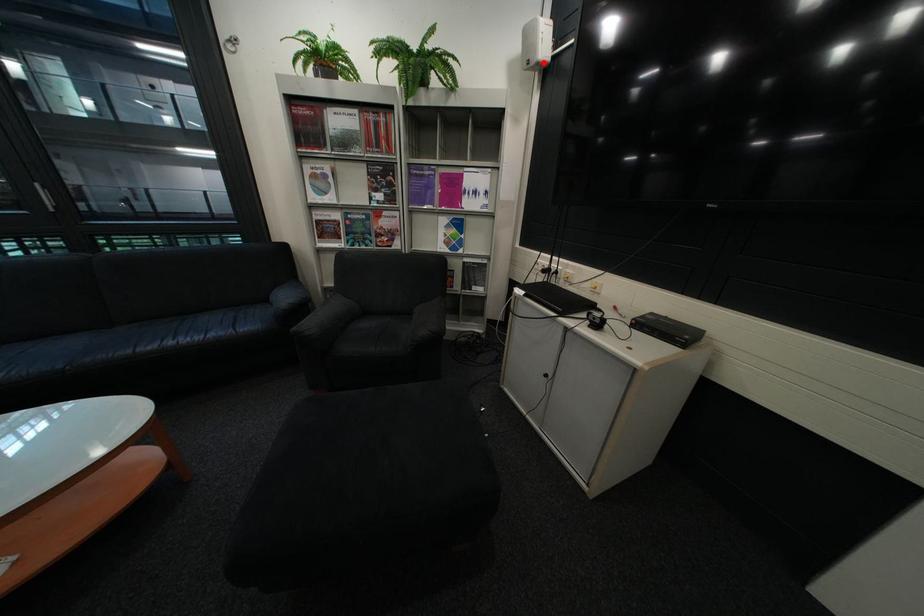
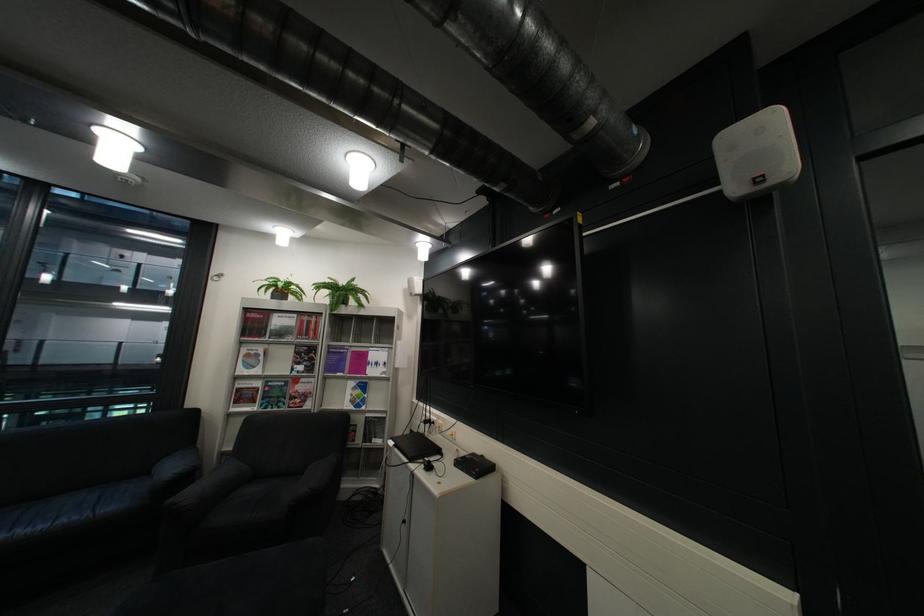
Where in the second image is the point corresponding to the highlighted location from the first image?

(427, 294)